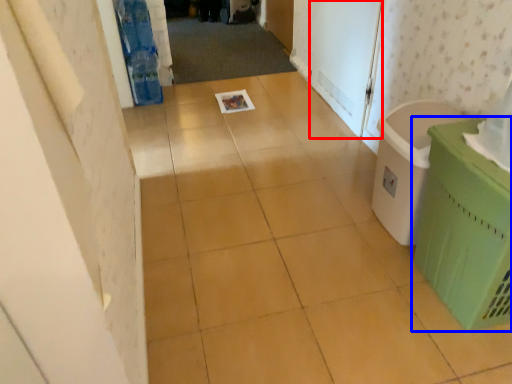
Question: Among these objects, which one is nearest to the camera, screen door (highlighted by a red box) or waste container (highlighted by a blue box)?

Choices:
 (A) screen door
 (B) waste container

Answer: (B)